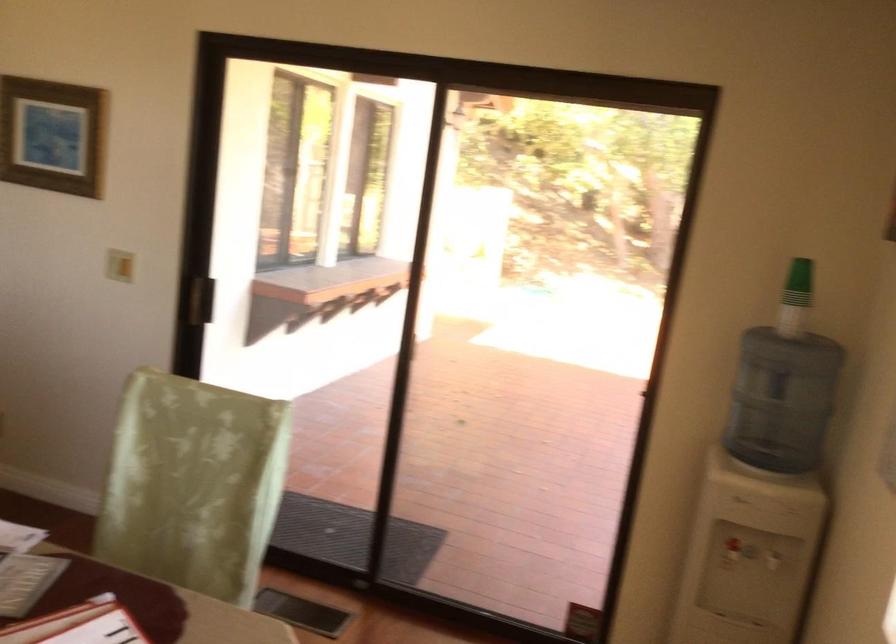
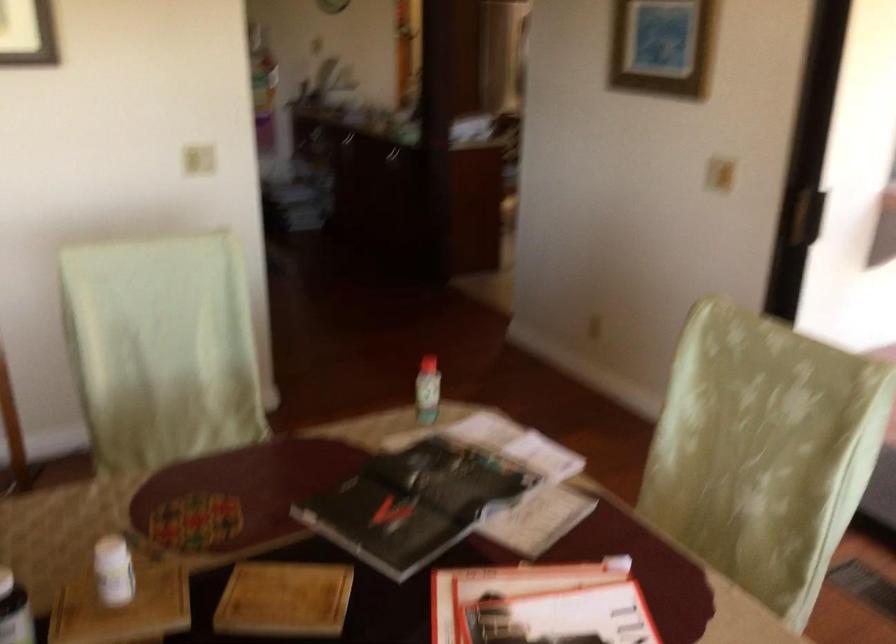
Question: The camera is either moving clockwise (left) or counter-clockwise (right) around the object. The first image is from the beginning of the video and the second image is from the end. Is the camera moving left or right when shooting the video?

Choices:
 (A) Left
 (B) Right

Answer: (B)